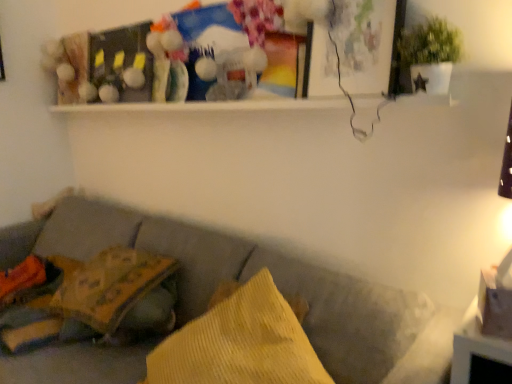
Where is `textured gray couch at lower left`? The height and width of the screenshot is (384, 512). textured gray couch at lower left is located at coordinates (274, 281).

Looking at this image, what is the approximate height of yellow corduroy pillow at center, the 1th pillow when ordered from right to left?

9.52 inches.

Image resolution: width=512 pixels, height=384 pixels. Describe the element at coordinates (240, 343) in the screenshot. I see `yellow corduroy pillow at center, the 2th pillow when ordered from left to right` at that location.

This screenshot has height=384, width=512. What are the coordinates of `textured gray couch at lower left` in the screenshot? It's located at (274, 281).

Who is more distant, yellow corduroy pillow at lower left, which appears as the 2th pillow when viewed from the right, or green matte plant at upper right?

yellow corduroy pillow at lower left, which appears as the 2th pillow when viewed from the right, is more distant.

Considering the sizes of objects yellow corduroy pillow at lower left, marked as the first pillow in a left-to-right arrangement, and green matte plant at upper right in the image provided, who is bigger, yellow corduroy pillow at lower left, marked as the first pillow in a left-to-right arrangement, or green matte plant at upper right?

Bigger between the two is yellow corduroy pillow at lower left, marked as the first pillow in a left-to-right arrangement.

From the image's perspective, which is above, yellow corduroy pillow at lower left, which appears as the 2th pillow when viewed from the right, or green matte plant at upper right?

green matte plant at upper right appears higher in the image.

From a real-world perspective, is textured gray couch at lower left located beneath green matte plant at upper right?

Indeed, from a real-world perspective, textured gray couch at lower left is positioned beneath green matte plant at upper right.

Can you confirm if textured gray couch at lower left is smaller than green matte plant at upper right?

Actually, textured gray couch at lower left might be larger than green matte plant at upper right.

Is textured gray couch at lower left in front of or behind green matte plant at upper right in the image?

textured gray couch at lower left is positioned closer to the viewer than green matte plant at upper right.

Is yellow corduroy pillow at lower left, acting as the 1th pillow starting from the back, oriented towards yellow corduroy pillow at center, the 2th pillow when ordered from left to right?

No, yellow corduroy pillow at lower left, acting as the 1th pillow starting from the back, is not aimed at yellow corduroy pillow at center, the 2th pillow when ordered from left to right.

Between yellow corduroy pillow at lower left, which appears as the 2th pillow when viewed from the right, and yellow corduroy pillow at center, the 2th pillow when ordered from left to right, which one is positioned behind?

yellow corduroy pillow at lower left, which appears as the 2th pillow when viewed from the right.

The height and width of the screenshot is (384, 512). I want to click on pillow to the left of yellow corduroy pillow at center, which appears as the first pillow when viewed from the front, so click(109, 285).

From the image's perspective, which one is positioned higher, yellow corduroy pillow at lower left, arranged as the second pillow when viewed from the front, or yellow corduroy pillow at center, the 1th pillow when ordered from right to left?

yellow corduroy pillow at lower left, arranged as the second pillow when viewed from the front, is shown above in the image.

In the image, there is a green matte plant at upper right. Where is `studio couch below it (from a real-world perspective)`? studio couch below it (from a real-world perspective) is located at coordinates (274, 281).

Which of these two, green matte plant at upper right or textured gray couch at lower left, is wider?

textured gray couch at lower left is wider.

Which point is more forward, (452, 60) or (400, 371)?

The point (400, 371) is closer.

What's the angular difference between green matte plant at upper right and textured gray couch at lower left's facing directions?

The angular difference between green matte plant at upper right and textured gray couch at lower left is 0.0618 degrees.

Can you tell me how much green matte plant at upper right and yellow corduroy pillow at center, which appears as the first pillow when viewed from the front, differ in facing direction?

There is a 28.3-degree angle between the facing directions of green matte plant at upper right and yellow corduroy pillow at center, which appears as the first pillow when viewed from the front.

From the image's perspective, which object appears higher, green matte plant at upper right or yellow corduroy pillow at center, which appears as the first pillow when viewed from the front?

green matte plant at upper right appears higher in the image.

Is green matte plant at upper right not within yellow corduroy pillow at center, which appears as the first pillow when viewed from the front?

Yes.

Which is closer, (426, 67) or (225, 361)?

The point (225, 361) is closer to the camera.

Considering the sizes of objects green matte plant at upper right and yellow corduroy pillow at lower left, marked as the first pillow in a left-to-right arrangement, in the image provided, who is smaller, green matte plant at upper right or yellow corduroy pillow at lower left, marked as the first pillow in a left-to-right arrangement,?

green matte plant at upper right.

What's the angular difference between green matte plant at upper right and yellow corduroy pillow at lower left, acting as the 1th pillow starting from the back,'s facing directions?

42.2 degrees separate the facing orientations of green matte plant at upper right and yellow corduroy pillow at lower left, acting as the 1th pillow starting from the back.

From the image's perspective, relative to yellow corduroy pillow at lower left, acting as the 1th pillow starting from the back, is green matte plant at upper right above or below?

Based on their image positions, green matte plant at upper right is located above yellow corduroy pillow at lower left, acting as the 1th pillow starting from the back.

Considering their positions, is green matte plant at upper right located in front of or behind yellow corduroy pillow at lower left, marked as the first pillow in a left-to-right arrangement?

Visually, green matte plant at upper right is located in front of yellow corduroy pillow at lower left, marked as the first pillow in a left-to-right arrangement.

Looking at their sizes, would you say textured gray couch at lower left is wider or thinner than yellow corduroy pillow at lower left, which appears as the 2th pillow when viewed from the right?

textured gray couch at lower left is wider than yellow corduroy pillow at lower left, which appears as the 2th pillow when viewed from the right.

From the picture: Is textured gray couch at lower left further to the viewer compared to yellow corduroy pillow at lower left, which appears as the 2th pillow when viewed from the right?

That is False.

Do you think textured gray couch at lower left is within yellow corduroy pillow at lower left, acting as the 1th pillow starting from the back, or outside of it?

textured gray couch at lower left lies outside yellow corduroy pillow at lower left, acting as the 1th pillow starting from the back.

Looking at this image, are textured gray couch at lower left and yellow corduroy pillow at lower left, marked as the first pillow in a left-to-right arrangement, far apart?

textured gray couch at lower left is near yellow corduroy pillow at lower left, marked as the first pillow in a left-to-right arrangement, not far away.

From a real-world perspective, count 2nd pillows downward from the green matte plant at upper right and point to it. Please provide its 2D coordinates.

[(109, 285)]

At what (x,y) coordinates should I click in order to perform the action: click on studio couch below the green matte plant at upper right (from the image's perspective). Please return your answer as a coordinate pair (x, y). Looking at the image, I should click on (274, 281).

Which object lies further to the anchor point textured gray couch at lower left, yellow corduroy pillow at center, acting as the second pillow starting from the back, or green matte plant at upper right?

Among the two, green matte plant at upper right is located further to textured gray couch at lower left.

From the image, which object appears to be nearer to yellow corduroy pillow at lower left, marked as the first pillow in a left-to-right arrangement, textured gray couch at lower left or green matte plant at upper right?

textured gray couch at lower left is closer to yellow corduroy pillow at lower left, marked as the first pillow in a left-to-right arrangement.

In the scene shown: Considering their positions, is green matte plant at upper right positioned closer to yellow corduroy pillow at center, which appears as the first pillow when viewed from the front, than yellow corduroy pillow at lower left, acting as the 1th pillow starting from the back?

yellow corduroy pillow at lower left, acting as the 1th pillow starting from the back, lies closer to yellow corduroy pillow at center, which appears as the first pillow when viewed from the front, than the other object.

When comparing their distances from green matte plant at upper right, does textured gray couch at lower left or yellow corduroy pillow at center, acting as the second pillow starting from the back, seem further?

textured gray couch at lower left is positioned further to the anchor green matte plant at upper right.

Considering their positions, is textured gray couch at lower left positioned closer to green matte plant at upper right than yellow corduroy pillow at lower left, marked as the first pillow in a left-to-right arrangement?

textured gray couch at lower left is positioned closer to the anchor green matte plant at upper right.

Looking at the image, which one is located further to textured gray couch at lower left, green matte plant at upper right or yellow corduroy pillow at center, the 2th pillow when ordered from left to right?

green matte plant at upper right is further to textured gray couch at lower left.

From the image, which object appears to be farther from green matte plant at upper right, yellow corduroy pillow at lower left, acting as the 1th pillow starting from the back, or yellow corduroy pillow at center, acting as the second pillow starting from the back?

The object further to green matte plant at upper right is yellow corduroy pillow at lower left, acting as the 1th pillow starting from the back.

From the image, which object appears to be farther from yellow corduroy pillow at center, the 2th pillow when ordered from left to right, yellow corduroy pillow at lower left, which appears as the 2th pillow when viewed from the right, or green matte plant at upper right?

green matte plant at upper right is positioned further to the anchor yellow corduroy pillow at center, the 2th pillow when ordered from left to right.

Where is `pillow between textured gray couch at lower left and yellow corduroy pillow at lower left, which appears as the 2th pillow when viewed from the right, from front to back`? This screenshot has height=384, width=512. pillow between textured gray couch at lower left and yellow corduroy pillow at lower left, which appears as the 2th pillow when viewed from the right, from front to back is located at coordinates (240, 343).

Identify the location of pillow between yellow corduroy pillow at lower left, acting as the 1th pillow starting from the back, and green matte plant at upper right, in the horizontal direction. (240, 343).